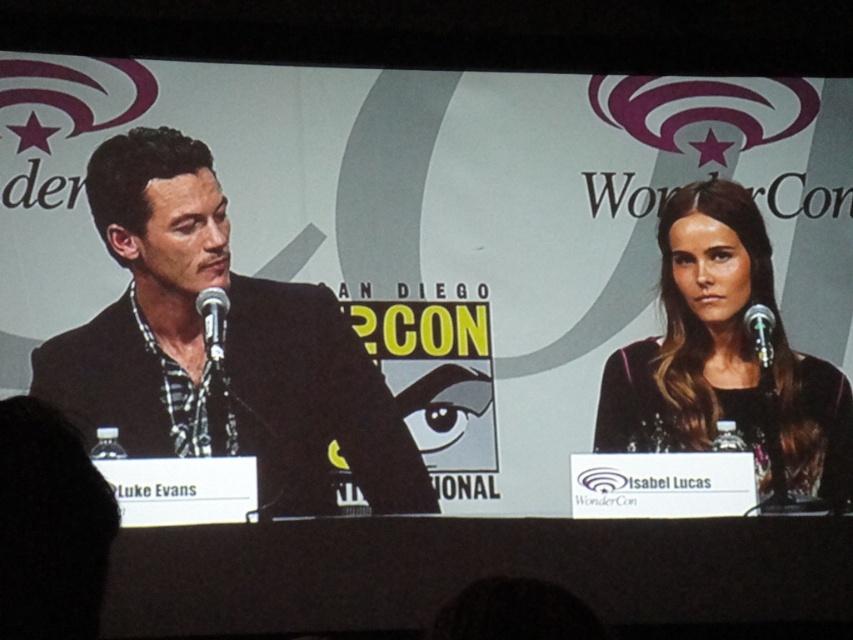
Question: Does black metallic microphone at left appear on the left side of silver metallic microphone at right?

Choices:
 (A) no
 (B) yes

Answer: (B)

Question: Where is black textured suit at left located in relation to silver metallic microphone at right in the image?

Choices:
 (A) right
 (B) left

Answer: (B)

Question: Which object is positioned farthest from the black textured suit at left?

Choices:
 (A) black sequined dress at right
 (B) silver metallic microphone at right
 (C) black metallic microphone at left

Answer: (B)

Question: Which of the following is the farthest from the observer?

Choices:
 (A) black sequined dress at right
 (B) black textured suit at left
 (C) black metallic microphone at left

Answer: (A)

Question: Among these objects, which one is farthest from the camera?

Choices:
 (A) black textured suit at left
 (B) black metallic microphone at left
 (C) black sequined dress at right

Answer: (C)

Question: Does black textured suit at left appear on the right side of black sequined dress at right?

Choices:
 (A) yes
 (B) no

Answer: (B)